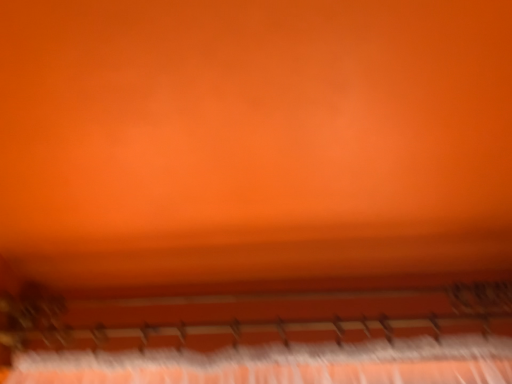
Image resolution: width=512 pixels, height=384 pixels. Describe the element at coordinates (265, 335) in the screenshot. I see `metallic silver musical keyboard at lower center` at that location.

In order to click on metallic silver musical keyboard at lower center in this screenshot , I will do `click(265, 335)`.

Locate an element on the screen. This screenshot has height=384, width=512. metallic silver musical keyboard at lower center is located at coordinates (265, 335).